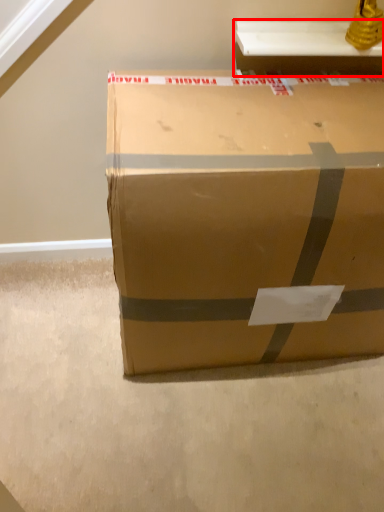
Question: Observing the image, what is the correct spatial positioning of table (annotated by the red box) in reference to box?

Choices:
 (A) left
 (B) right

Answer: (B)